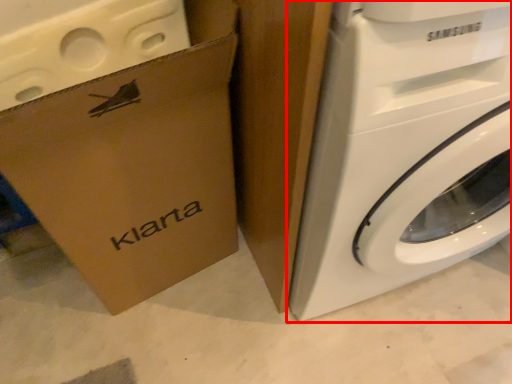
Question: From the image's perspective, what is the correct spatial relationship of washing machine (annotated by the red box) in relation to cardboard box?

Choices:
 (A) below
 (B) above

Answer: (B)